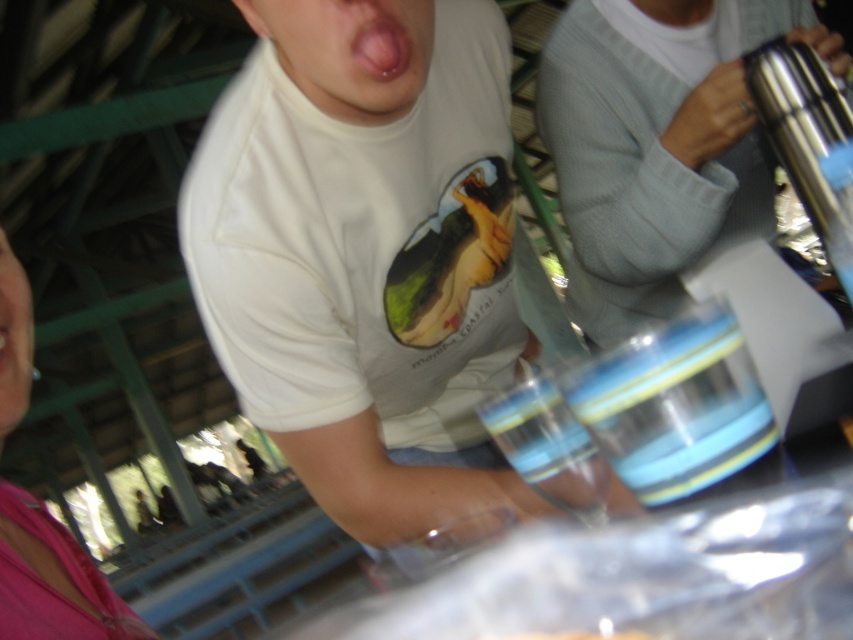
Question: Among these points, which one is farthest from the camera?

Choices:
 (A) (13, 372)
 (B) (480, 432)
 (C) (73, 540)

Answer: (B)

Question: Which is farther from the dry skin at center?

Choices:
 (A) metallic silver thermos at right
 (B) pink fabric shirt at lower left
 (C) blue striped glass at center
 (D) pink flesh at center

Answer: (A)

Question: Can you confirm if metallic silver thermos at right is wider than blue striped glass at center?

Choices:
 (A) no
 (B) yes

Answer: (B)

Question: Observing the image, what is the correct spatial positioning of pink fabric shirt at lower left in reference to pink flesh at center?

Choices:
 (A) right
 (B) left

Answer: (B)

Question: Which object is positioned closest to the blue striped glass at center?

Choices:
 (A) pink fabric shirt at lower left
 (B) pink flesh at center
 (C) dry skin at center
 (D) white matte t-shirt at center

Answer: (B)

Question: Can you confirm if white matte t-shirt at center is positioned above blue striped glass at center?

Choices:
 (A) yes
 (B) no

Answer: (A)